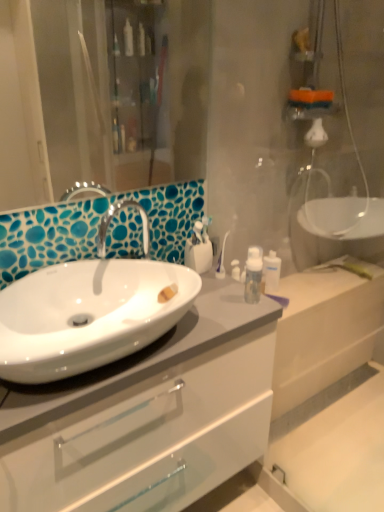
Describe the element at coordinates (87, 315) in the screenshot. I see `white glossy sink at center left` at that location.

This screenshot has width=384, height=512. Find the location of `transparent plastic bottle at upper right, which is counted as the 1th toiletry, starting from the right`. transparent plastic bottle at upper right, which is counted as the 1th toiletry, starting from the right is located at coordinates (271, 271).

Find the location of a particular element. The image size is (384, 512). white glossy toothbrush holder at center, acting as the 2th toiletry starting from the back is located at coordinates (199, 248).

Is white glossy toothbrush holder at center, the 1th toiletry in the left-to-right sequence, at the back of white glossy cabinet at center?

No.

Is white glossy cabinet at center wider or thinner than white glossy toothbrush holder at center, the second toiletry when ordered from right to left?

Considering their sizes, white glossy cabinet at center looks broader than white glossy toothbrush holder at center, the second toiletry when ordered from right to left.

At what (x,y) coordinates should I click in order to perform the action: click on the 2nd toiletry directly above the white glossy cabinet at center (from a real-world perspective). Please return your answer as a coordinate pair (x, y). The height and width of the screenshot is (512, 384). Looking at the image, I should click on (199, 248).

From the image's perspective, relative to white glossy toothbrush holder at center, the 1th toiletry in the left-to-right sequence, is white glossy cabinet at center above or below?

white glossy cabinet at center is below white glossy toothbrush holder at center, the 1th toiletry in the left-to-right sequence.

Is white glossy cabinet at center next to transparent plastic bottle at upper right, which is counted as the 1th toiletry, starting from the right, and touching it?

white glossy cabinet at center is not next to transparent plastic bottle at upper right, which is counted as the 1th toiletry, starting from the right, and they're not touching.

This screenshot has height=512, width=384. In order to click on bathroom cabinet lying on the left of transparent plastic bottle at upper right, acting as the 2th toiletry starting from the front in this screenshot , I will do `click(147, 416)`.

Is white glossy cabinet at center smaller than transparent plastic bottle at upper right, the second toiletry viewed from the left?

Incorrect, white glossy cabinet at center is not smaller in size than transparent plastic bottle at upper right, the second toiletry viewed from the left.

In the scene shown: Considering the sizes of white glossy cabinet at center and transparent plastic bottle at upper right, the second toiletry viewed from the left, in the image, is white glossy cabinet at center wider or thinner than transparent plastic bottle at upper right, the second toiletry viewed from the left,?

white glossy cabinet at center is wider than transparent plastic bottle at upper right, the second toiletry viewed from the left.

How different are the orientations of white glossy sink at center left and white glossy cabinet at center in degrees?

There is a 0.000195-degree angle between the facing directions of white glossy sink at center left and white glossy cabinet at center.

Can white glossy cabinet at center be found inside white glossy sink at center left?

No.

From a real-world perspective, who is located lower, white glossy sink at center left or white glossy cabinet at center?

From a 3D spatial view, white glossy cabinet at center is below.

From the picture: From the image's perspective, between white glossy sink at center left and white glossy cabinet at center, who is located below?

white glossy cabinet at center.

Can you confirm if white glossy toothbrush holder at center, the 1th toiletry when ordered from front to back, is wider than transparent plastic bottle at upper right, the 1th toiletry from the back?

Yes, white glossy toothbrush holder at center, the 1th toiletry when ordered from front to back, is wider than transparent plastic bottle at upper right, the 1th toiletry from the back.

Which of these two, white glossy toothbrush holder at center, the second toiletry when ordered from right to left, or transparent plastic bottle at upper right, the second toiletry viewed from the left, is smaller?

Smaller between the two is transparent plastic bottle at upper right, the second toiletry viewed from the left.

Is white glossy toothbrush holder at center, the 1th toiletry when ordered from front to back, beside transparent plastic bottle at upper right, which is counted as the 1th toiletry, starting from the right?

No, white glossy toothbrush holder at center, the 1th toiletry when ordered from front to back, is not beside transparent plastic bottle at upper right, which is counted as the 1th toiletry, starting from the right.

Can you confirm if white glossy toothbrush holder at center, the second toiletry when ordered from right to left, is positioned to the right of transparent plastic bottle at upper right, the second toiletry viewed from the left?

No, white glossy toothbrush holder at center, the second toiletry when ordered from right to left, is not to the right of transparent plastic bottle at upper right, the second toiletry viewed from the left.

Considering the positions of objects white glossy toothbrush holder at center, the 1th toiletry when ordered from front to back, and white glossy cabinet at center in the image provided, who is behind, white glossy toothbrush holder at center, the 1th toiletry when ordered from front to back, or white glossy cabinet at center?

white glossy toothbrush holder at center, the 1th toiletry when ordered from front to back, is further away from the camera.

Is point (192, 243) farther from camera compared to point (167, 459)?

Yes, point (192, 243) is farther from viewer.

Does white glossy toothbrush holder at center, the second toiletry when ordered from right to left, have a greater width compared to white glossy cabinet at center?

No.

Is white glossy toothbrush holder at center, the 1th toiletry when ordered from front to back, facing towards white glossy cabinet at center?

No, white glossy toothbrush holder at center, the 1th toiletry when ordered from front to back, is not oriented towards white glossy cabinet at center.

Based on the photo, which is in front, transparent plastic bottle at upper right, the second toiletry viewed from the left, or white glossy toothbrush holder at center, the second toiletry when ordered from right to left?

white glossy toothbrush holder at center, the second toiletry when ordered from right to left, is more forward.

In terms of height, does transparent plastic bottle at upper right, the 1th toiletry from the back, look taller or shorter compared to white glossy toothbrush holder at center, the second toiletry when ordered from right to left?

transparent plastic bottle at upper right, the 1th toiletry from the back, is taller than white glossy toothbrush holder at center, the second toiletry when ordered from right to left.

Would you say transparent plastic bottle at upper right, acting as the 2th toiletry starting from the front, is a long distance from white glossy toothbrush holder at center, the 1th toiletry when ordered from front to back?

No, transparent plastic bottle at upper right, acting as the 2th toiletry starting from the front, is not far from white glossy toothbrush holder at center, the 1th toiletry when ordered from front to back.

How many degrees apart are the facing directions of transparent plastic bottle at upper right, the 1th toiletry from the back, and white glossy cabinet at center?

The angle between the facing direction of transparent plastic bottle at upper right, the 1th toiletry from the back, and the facing direction of white glossy cabinet at center is 32.4 degrees.

Is transparent plastic bottle at upper right, the 1th toiletry from the back, shorter than white glossy cabinet at center?

Yes.

Is transparent plastic bottle at upper right, which is counted as the 1th toiletry, starting from the right, completely or partially outside of white glossy cabinet at center?

transparent plastic bottle at upper right, which is counted as the 1th toiletry, starting from the right, is positioned outside white glossy cabinet at center.

Which is behind, point (277, 273) or point (243, 448)?

Point (277, 273)

Find the location of a particular element. This screenshot has height=512, width=384. bathroom cabinet below the white glossy toothbrush holder at center, the second toiletry when ordered from right to left (from a real-world perspective) is located at coordinates (147, 416).

In order to click on the 2nd toiletry to the right of the white glossy cabinet at center, starting your count from the anchor in this screenshot , I will do `click(271, 271)`.

Based on their spatial positions, is white glossy sink at center left or white glossy cabinet at center closer to transparent plastic bottle at upper right, acting as the 2th toiletry starting from the front?

Based on the image, white glossy cabinet at center appears to be nearer to transparent plastic bottle at upper right, acting as the 2th toiletry starting from the front.

Which object lies nearer to the anchor point white glossy cabinet at center, white glossy sink at center left or transparent plastic bottle at upper right, the 1th toiletry from the back?

Among the two, white glossy sink at center left is located nearer to white glossy cabinet at center.

Estimate the real-world distances between objects in this image. Which object is further from transparent plastic bottle at upper right, which is counted as the 1th toiletry, starting from the right, white glossy toothbrush holder at center, the second toiletry when ordered from right to left, or white glossy cabinet at center?

white glossy cabinet at center is positioned further to the anchor transparent plastic bottle at upper right, which is counted as the 1th toiletry, starting from the right.

Estimate the real-world distances between objects in this image. Which object is closer to white glossy cabinet at center, white glossy sink at center left or white glossy toothbrush holder at center, acting as the 2th toiletry starting from the back?

Based on the image, white glossy sink at center left appears to be nearer to white glossy cabinet at center.

Considering their positions, is transparent plastic bottle at upper right, which is counted as the 1th toiletry, starting from the right, positioned further to white glossy toothbrush holder at center, the 1th toiletry in the left-to-right sequence, than white glossy cabinet at center?

white glossy cabinet at center is positioned further to the anchor white glossy toothbrush holder at center, the 1th toiletry in the left-to-right sequence.

Which object lies nearer to the anchor point white glossy toothbrush holder at center, the 1th toiletry in the left-to-right sequence, transparent plastic bottle at upper right, which is counted as the 1th toiletry, starting from the right, or white glossy sink at center left?

transparent plastic bottle at upper right, which is counted as the 1th toiletry, starting from the right, is closer to white glossy toothbrush holder at center, the 1th toiletry in the left-to-right sequence.

Based on the photo, based on their spatial positions, is white glossy toothbrush holder at center, the 1th toiletry in the left-to-right sequence, or white glossy cabinet at center further from white glossy sink at center left?

white glossy toothbrush holder at center, the 1th toiletry in the left-to-right sequence.

Estimate the real-world distances between objects in this image. Which object is further from white glossy sink at center left, white glossy toothbrush holder at center, the 1th toiletry when ordered from front to back, or transparent plastic bottle at upper right, which is counted as the 1th toiletry, starting from the right?

The object further to white glossy sink at center left is transparent plastic bottle at upper right, which is counted as the 1th toiletry, starting from the right.

You are a GUI agent. You are given a task and a screenshot of the screen. Output one action in this format:
    pyautogui.click(x=<x>, y=<y>)
    Task: Click on the toiletry located between white glossy sink at center left and transparent plastic bottle at upper right, which is counted as the 1th toiletry, starting from the right, in the depth direction
    This screenshot has width=384, height=512.
    Given the screenshot: What is the action you would take?
    pyautogui.click(x=199, y=248)

At what (x,y) coordinates should I click in order to perform the action: click on toiletry located between white glossy cabinet at center and transparent plastic bottle at upper right, the 1th toiletry from the back, in the depth direction. Please return your answer as a coordinate pair (x, y). This screenshot has width=384, height=512. Looking at the image, I should click on (199, 248).

Where is `bathroom cabinet located between white glossy sink at center left and white glossy toothbrush holder at center, the 1th toiletry in the left-to-right sequence, in the depth direction`? bathroom cabinet located between white glossy sink at center left and white glossy toothbrush holder at center, the 1th toiletry in the left-to-right sequence, in the depth direction is located at coordinates (147, 416).

The width and height of the screenshot is (384, 512). In order to click on bathroom cabinet between white glossy sink at center left and transparent plastic bottle at upper right, which is counted as the 1th toiletry, starting from the right, in the front-back direction in this screenshot , I will do `click(147, 416)`.